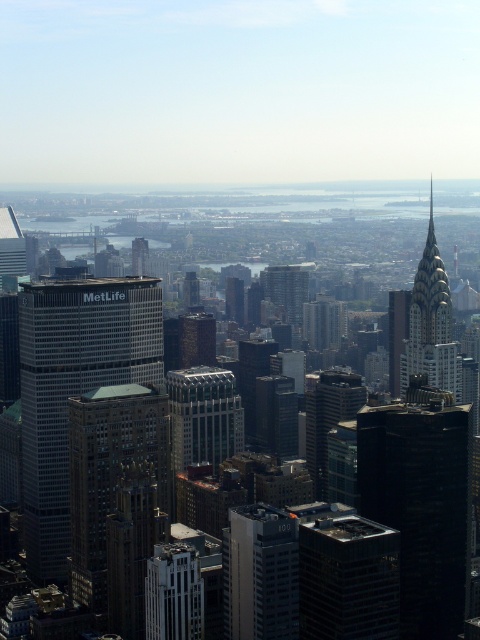
Question: Is dark glass skyscraper at center above white glass building at center?

Choices:
 (A) no
 (B) yes

Answer: (B)

Question: Among these objects, which one is nearest to the camera?

Choices:
 (A) dark glass skyscraper at center
 (B) white glass building at center
 (C) matte glass building at center

Answer: (C)

Question: Which object is positioned closest to the brown stone building at center?

Choices:
 (A) glassy reflective skyscraper at center
 (B) dark glass skyscraper at center

Answer: (A)

Question: Is glassy reflective skyscraper at center bigger than matte glass skyscraper at left?

Choices:
 (A) yes
 (B) no

Answer: (A)

Question: Which point is farther to the camera?

Choices:
 (A) (4, 257)
 (B) (48, 376)
 (C) (295, 288)

Answer: (A)

Question: From the image, what is the correct spatial relationship of brown brick building at center in relation to brown stone building at center?

Choices:
 (A) left
 (B) right

Answer: (A)